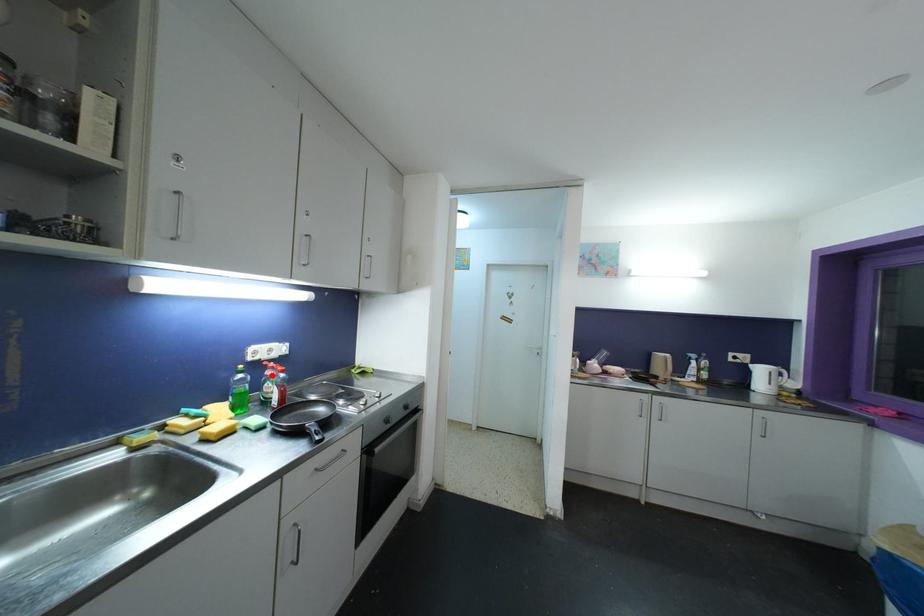
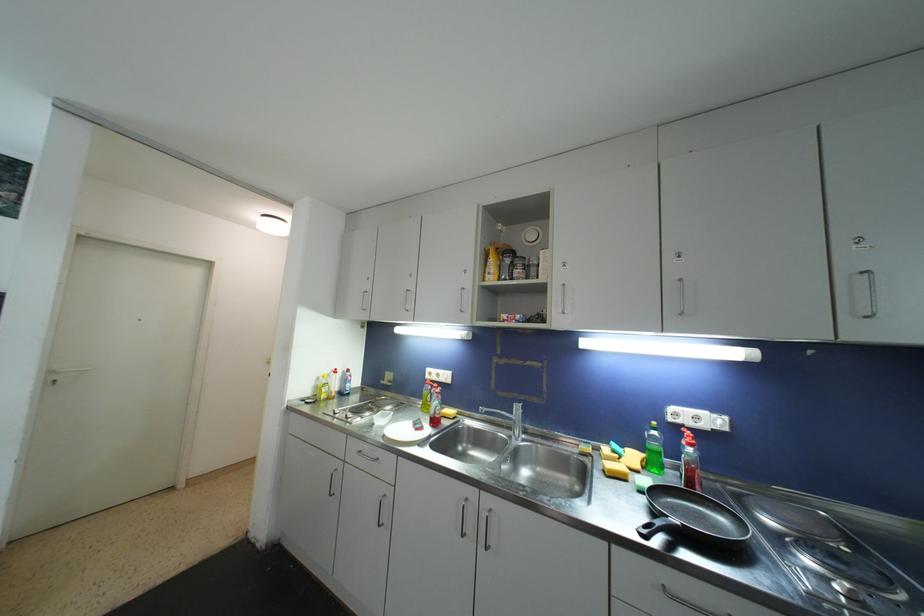
In the second image, find the point that corresponds to the highlighted location in the first image.

(687, 445)